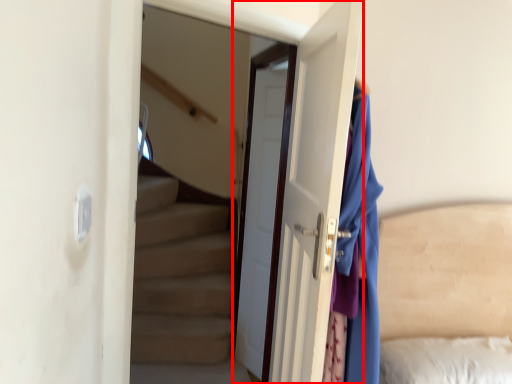
Question: From the image's perspective, considering the relative positions of door (annotated by the red box) and door in the image provided, where is door (annotated by the red box) located with respect to the staircase?

Choices:
 (A) above
 (B) below

Answer: (B)